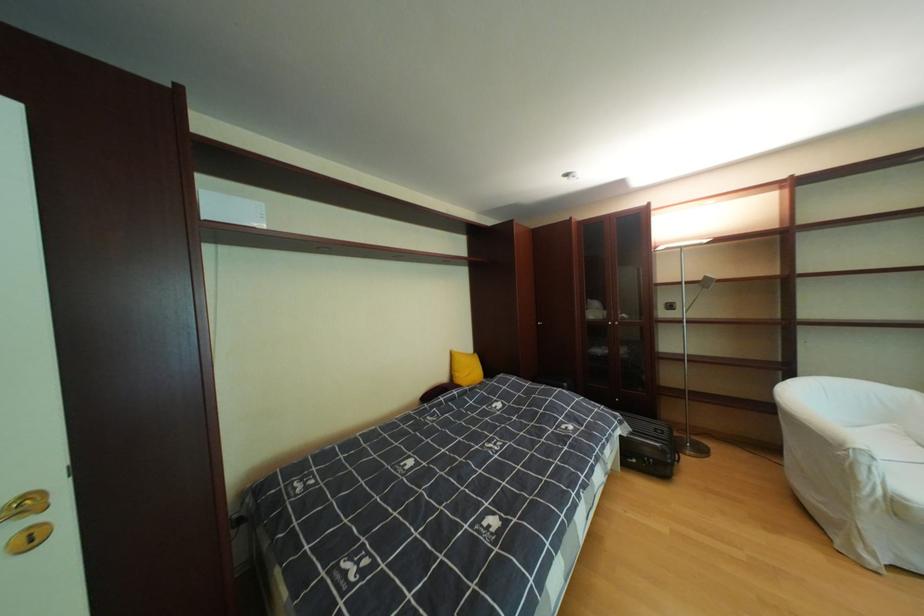
Locate an element on the screen. yellow pillow is located at coordinates (465, 368).